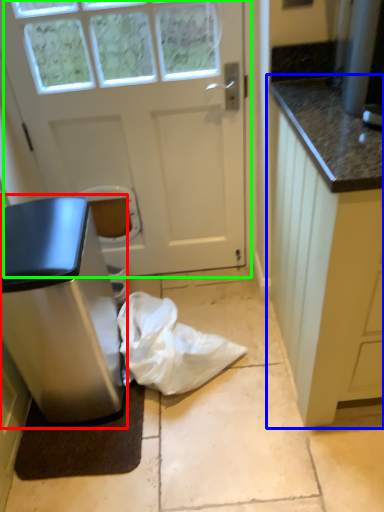
Question: Which object is the closest to the home appliance (highlighted by a red box)? Choose among these: cabinetry (highlighted by a blue box) or door (highlighted by a green box).

Choices:
 (A) cabinetry
 (B) door

Answer: (B)